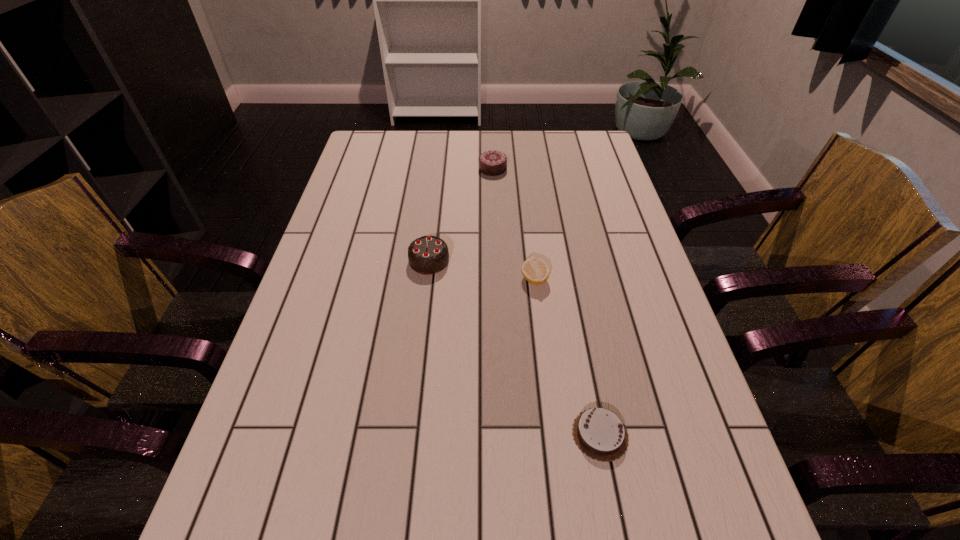
Where is `free space located on the back of the second shortest object`? free space located on the back of the second shortest object is located at coordinates (525, 206).

Identify the location of vacant space situated 0.190m on the left of the shortest chocolate cake. This screenshot has height=540, width=960. (471, 435).

The height and width of the screenshot is (540, 960). Find the location of `object that is at the far edge`. object that is at the far edge is located at coordinates (492, 163).

Identify the location of object located at the right edge. The image size is (960, 540). (599, 433).

In the image, there is a desktop. In order to click on vacant region at the far edge in this screenshot , I will do `click(507, 151)`.

I want to click on vacant area at the left edge, so click(242, 504).

Locate an element on the screen. vacant space at the right edge is located at coordinates (639, 268).

Identify the location of vacant space that's between the second object from right to left and the nearest chocolate cake. (567, 357).

Identify the location of vacant space that's between the tallest object and the nearest chocolate cake. click(515, 348).

At what (x,y) coordinates should I click in order to perform the action: click on vacant region between the lemon and the second chocolate cake from right to left. Please return your answer as a coordinate pair (x, y). Looking at the image, I should click on tap(514, 224).